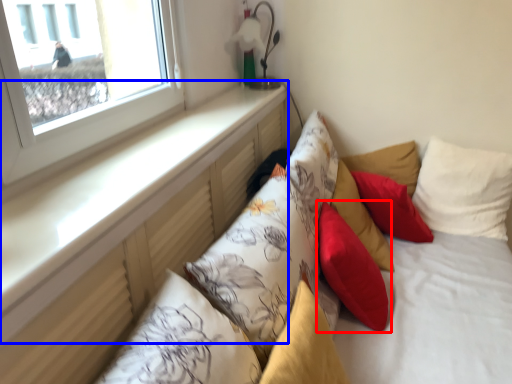
Question: Which object is further to the camera taking this photo, pillow (highlighted by a red box) or window sill (highlighted by a blue box)?

Choices:
 (A) pillow
 (B) window sill

Answer: (A)